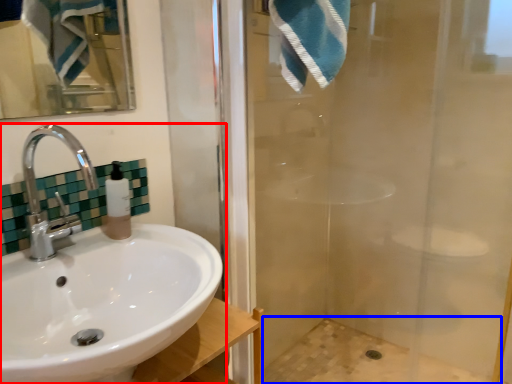
Question: Among these objects, which one is farthest to the camera, sink (highlighted by a red box) or bath (highlighted by a blue box)?

Choices:
 (A) sink
 (B) bath

Answer: (B)